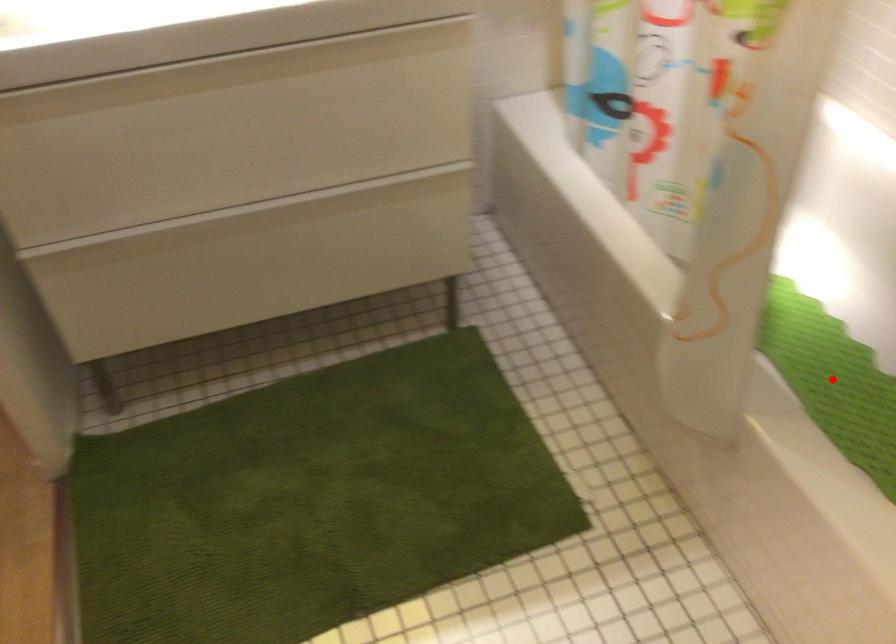
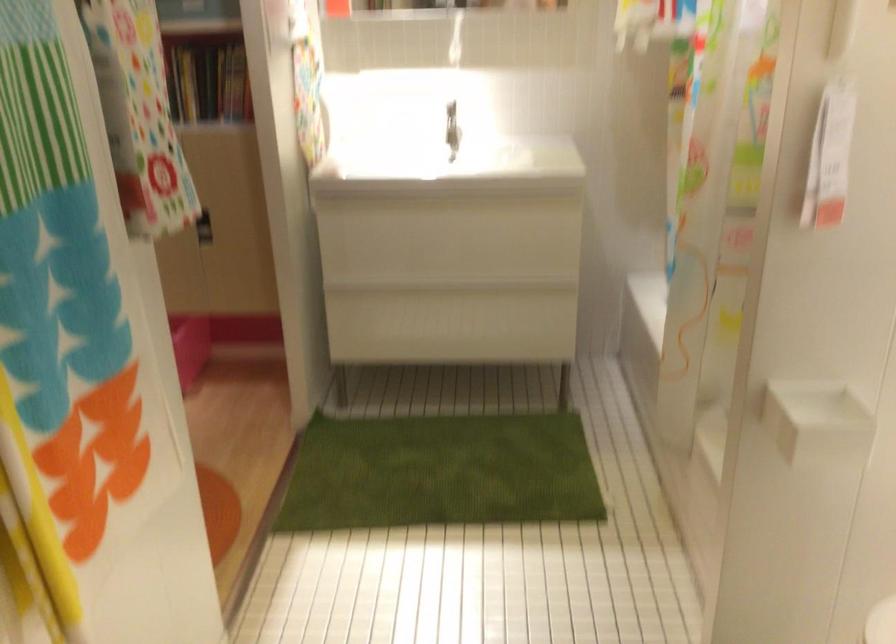
Question: I am providing you with two images of the same scene from different viewpoints. A red point is marked on the first image. Is the red point's position out of view in image 2?

Choices:
 (A) Yes
 (B) No

Answer: (A)